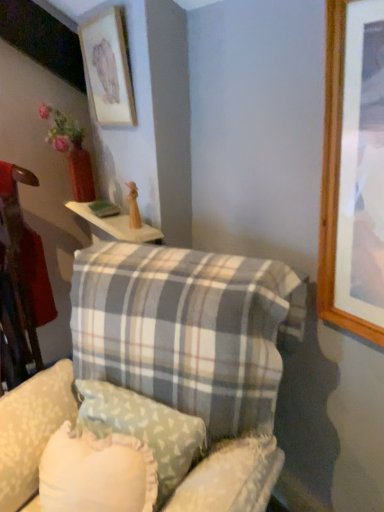
Question: Is the depth of matte wooden picture frame at upper left greater than that of light blue fabric pillow at center, which is counted as the first pillow, starting from the back?

Choices:
 (A) yes
 (B) no

Answer: (A)

Question: Does matte wooden picture frame at upper left have a lesser width compared to light blue fabric pillow at center, which is counted as the first pillow, starting from the back?

Choices:
 (A) no
 (B) yes

Answer: (B)

Question: Considering the relative sizes of matte wooden picture frame at upper left and light blue fabric pillow at center, which is counted as the first pillow, starting from the back, in the image provided, is matte wooden picture frame at upper left taller than light blue fabric pillow at center, which is counted as the first pillow, starting from the back,?

Choices:
 (A) no
 (B) yes

Answer: (B)

Question: Is matte wooden picture frame at upper left outside light blue fabric pillow at center, the 2th pillow positioned from the front?

Choices:
 (A) yes
 (B) no

Answer: (A)

Question: Could you tell me if matte wooden picture frame at upper left is turned towards light blue fabric pillow at center, which is counted as the first pillow, starting from the back?

Choices:
 (A) no
 (B) yes

Answer: (A)

Question: Would you consider matte wooden picture frame at upper left to be distant from light blue fabric pillow at center, which is counted as the first pillow, starting from the back?

Choices:
 (A) yes
 (B) no

Answer: (A)

Question: Does matte wooden picture frame at upper left have a greater height compared to plaid fabric swivel chair at lower center?

Choices:
 (A) no
 (B) yes

Answer: (B)

Question: Is matte wooden picture frame at upper left directly adjacent to plaid fabric swivel chair at lower center?

Choices:
 (A) no
 (B) yes

Answer: (A)

Question: Is matte wooden picture frame at upper left oriented away from plaid fabric swivel chair at lower center?

Choices:
 (A) yes
 (B) no

Answer: (B)

Question: From the image's perspective, is matte wooden picture frame at upper left located above plaid fabric swivel chair at lower center?

Choices:
 (A) yes
 (B) no

Answer: (A)

Question: Is matte wooden picture frame at upper left not close to plaid fabric swivel chair at lower center?

Choices:
 (A) yes
 (B) no

Answer: (A)

Question: Is matte wooden picture frame at upper left facing towards plaid fabric swivel chair at lower center?

Choices:
 (A) no
 (B) yes

Answer: (A)

Question: Can you confirm if plaid fabric pillow at center, the first pillow positioned from the front, is smaller than plaid fabric swivel chair at lower center?

Choices:
 (A) no
 (B) yes

Answer: (A)